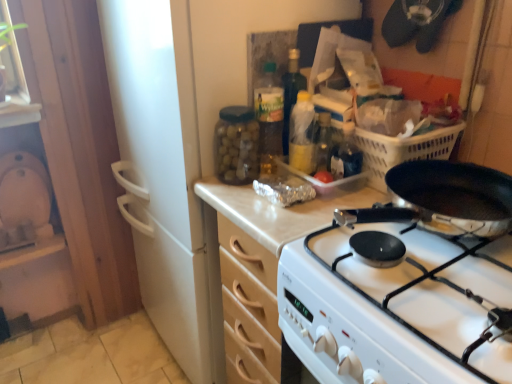
Where is `free region on the left part of translucent plastic bottle at center, acting as the third bottle starting from the left`? This screenshot has height=384, width=512. free region on the left part of translucent plastic bottle at center, acting as the third bottle starting from the left is located at coordinates (238, 188).